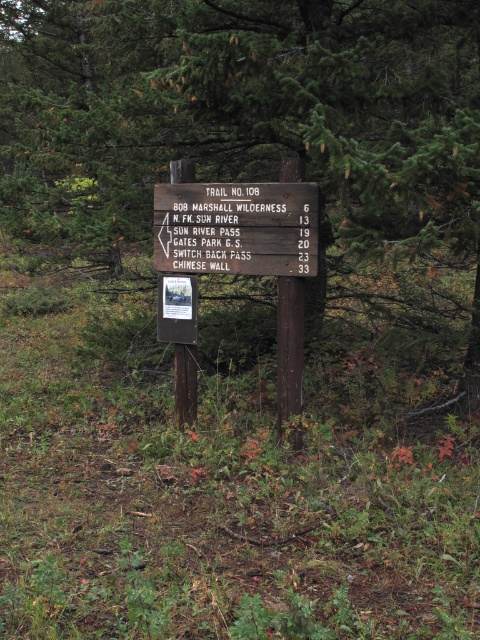
You are a hiker who wants to reach the Switch Back Pass. You see a green pine tree at center and a wooden sign at center. Which object is closer to your current position?

The green pine tree at center is smaller than wooden sign at center, so the green pine tree at center is closer to your current position because smaller objects in the foreground appear smaller than larger ones in the background.